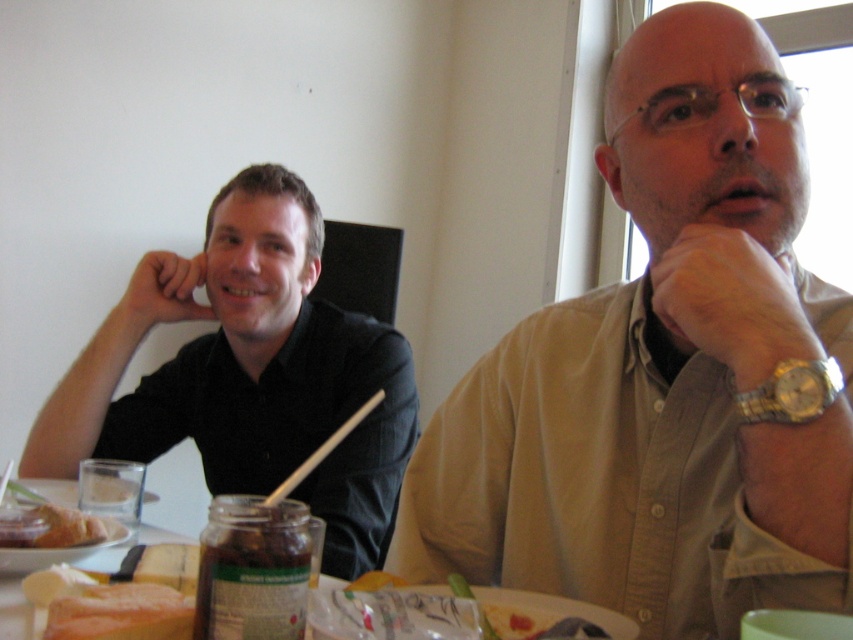
Question: Among these points, which one is nearest to the camera?

Choices:
 (A) (9, 536)
 (B) (379, 397)
 (C) (88, 352)
 (D) (32, 484)

Answer: (A)

Question: Estimate the real-world distances between objects in this image. Which object is farther from the white matte plate at lower left?

Choices:
 (A) white wood chopstick at center
 (B) white bread at lower left
 (C) light beige shirt at center

Answer: (C)

Question: Can you confirm if wooden table at center is positioned to the left of golden bread at lower left?

Choices:
 (A) no
 (B) yes

Answer: (A)

Question: Estimate the real-world distances between objects in this image. Which object is closer to the black matte shirt at left?

Choices:
 (A) golden bread at lower left
 (B) gold metallic watch at right

Answer: (A)

Question: Is white bread at lower left thinner than gold metallic watch at right?

Choices:
 (A) yes
 (B) no

Answer: (B)

Question: Is light beige shirt at center wider than gold metallic watch at right?

Choices:
 (A) no
 (B) yes

Answer: (B)